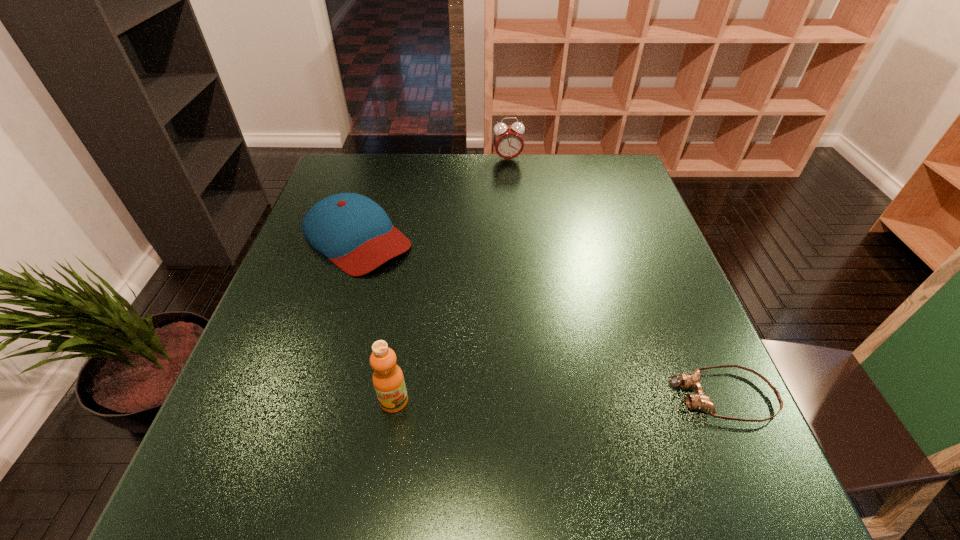
Identify the location of vacant space that's between the orange juice and the second shortest object. (375, 319).

At what (x,y) coordinates should I click in order to perform the action: click on free space between the rightmost object and the third tallest object. Please return your answer as a coordinate pair (x, y). Looking at the image, I should click on (540, 317).

Where is `free space between the goggles and the baseball cap`? This screenshot has width=960, height=540. free space between the goggles and the baseball cap is located at coordinates (540, 317).

In order to click on free space between the third tallest object and the orange juice in this screenshot , I will do `click(375, 319)`.

Where is `vacant space that is in between the orange juice and the second farthest object`? The image size is (960, 540). vacant space that is in between the orange juice and the second farthest object is located at coordinates pos(375,319).

This screenshot has height=540, width=960. I want to click on free spot between the second shortest object and the rightmost object, so pos(540,317).

Identify which object is located as the second nearest to the third tallest object. Please provide its 2D coordinates. Your answer should be formatted as a tuple, i.e. [(x, y)], where the tuple contains the x and y coordinates of a point satisfying the conditions above.

[(508, 141)]

Select which object appears as the closest to the rightmost object. Please provide its 2D coordinates. Your answer should be formatted as a tuple, i.e. [(x, y)], where the tuple contains the x and y coordinates of a point satisfying the conditions above.

[(388, 380)]

At what (x,y) coordinates should I click in order to perform the action: click on free space that satisfies the following two spatial constraints: 1. on the front side of the shortest object; 2. on the front lenses and sides of the baseball cap. Please return your answer as a coordinate pair (x, y). This screenshot has height=540, width=960. Looking at the image, I should click on (308, 396).

Identify the location of free space that satisfies the following two spatial constraints: 1. on the front side of the baseball cap; 2. on the front lenses and sides of the goggles. pyautogui.click(x=308, y=396).